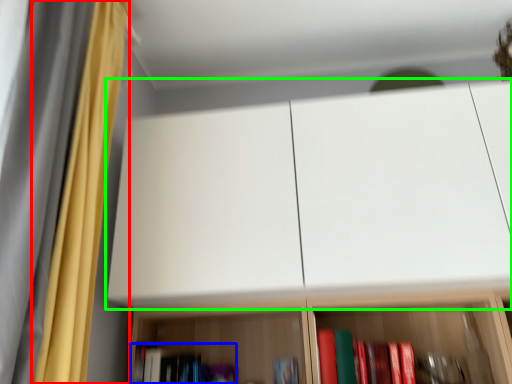
Question: Which is nearer to the curtain (highlighted by a red box)? book (highlighted by a blue box) or cabinetry (highlighted by a green box).

Choices:
 (A) book
 (B) cabinetry

Answer: (B)